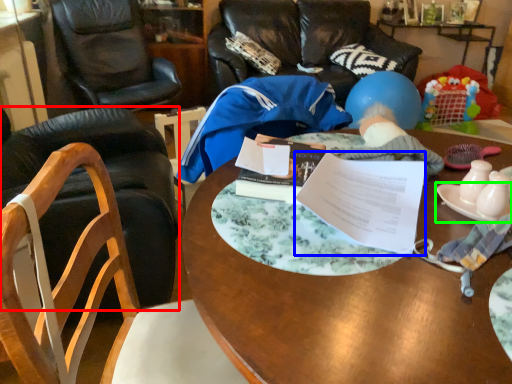
Question: Which object is the closest to the chair (highlighted by a red box)? Choose among these: document (highlighted by a blue box) or plate (highlighted by a green box).

Choices:
 (A) document
 (B) plate

Answer: (A)